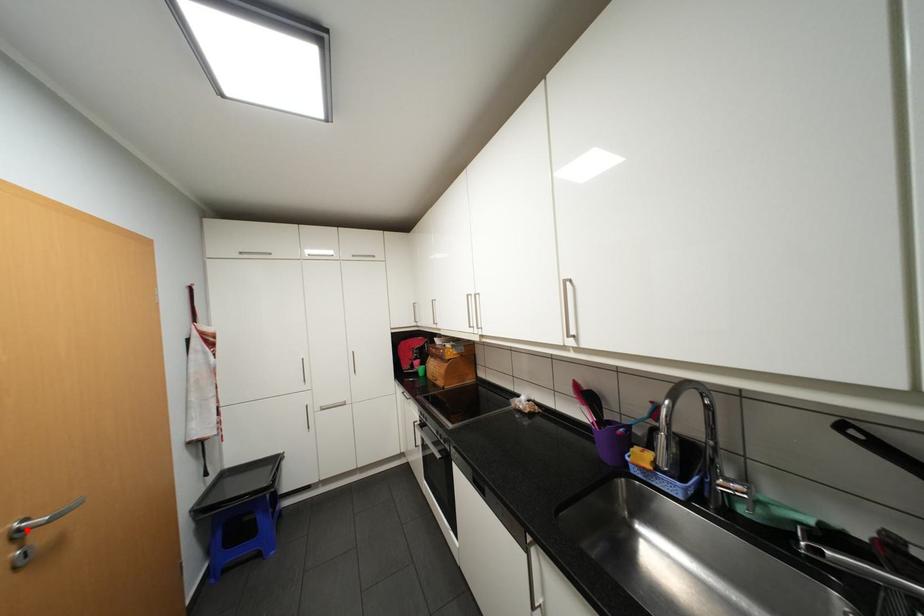
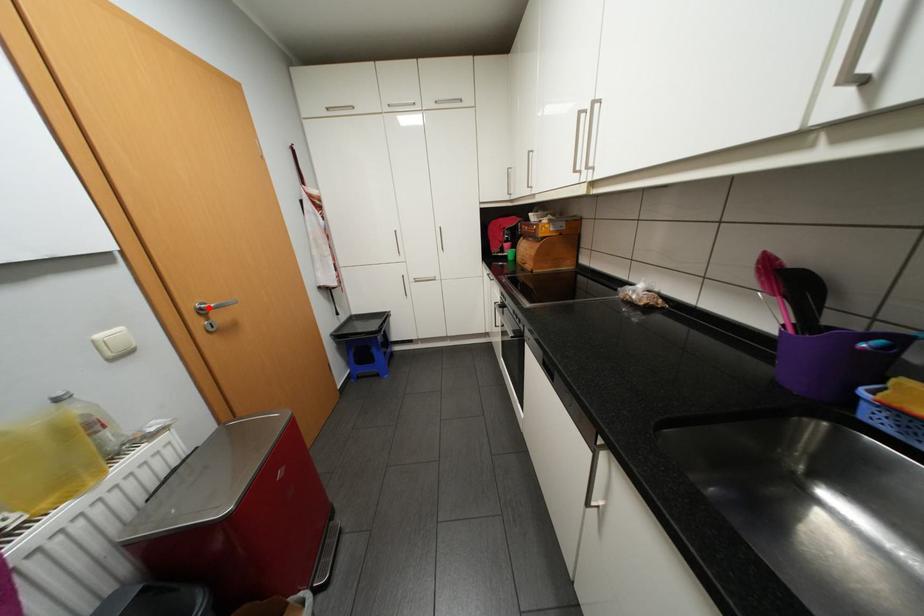
I am providing you with two images of the same scene from different viewpoints. A red point is marked on the first image and another point is marked on the second image. Is the red point in image1 aligned with the point shown in image2?

Yes